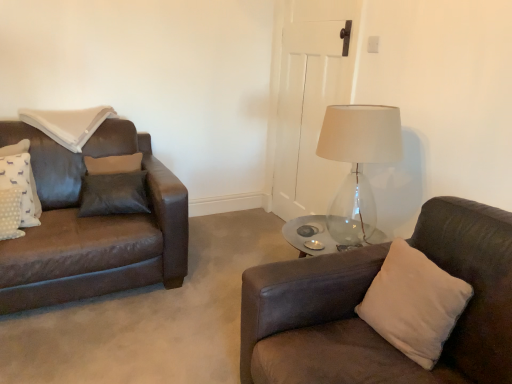
Question: Can you confirm if white fabric pillow at upper left, the 3th pillow viewed from the front, is bigger than white dotted fabric pillow at left, the 3th pillow from the right?

Choices:
 (A) no
 (B) yes

Answer: (B)

Question: Is white fabric pillow at upper left, which is the second pillow in left-to-right order, aimed at white dotted fabric pillow at left, positioned as the second pillow in top-to-bottom order?

Choices:
 (A) yes
 (B) no

Answer: (B)

Question: Is white fabric pillow at upper left, placed as the first pillow when sorted from back to front, surrounding white dotted fabric pillow at left, placed as the second pillow when sorted from front to back?

Choices:
 (A) no
 (B) yes

Answer: (A)

Question: Does white fabric pillow at upper left, marked as the third pillow in a bottom-to-top arrangement, have a greater height compared to white dotted fabric pillow at left, the 3th pillow from the right?

Choices:
 (A) yes
 (B) no

Answer: (B)

Question: Is white fabric pillow at upper left, placed as the first pillow when sorted from back to front, to the left of white dotted fabric pillow at left, which ranks as the 2th pillow in back-to-front order, from the viewer's perspective?

Choices:
 (A) yes
 (B) no

Answer: (B)

Question: Considering the positions of white dotted fabric pillow at left, which appears as the 2th pillow when ordered from the bottom, and white fabric pillow at upper left, which is the second pillow in left-to-right order, in the image, is white dotted fabric pillow at left, which appears as the 2th pillow when ordered from the bottom, taller or shorter than white fabric pillow at upper left, which is the second pillow in left-to-right order,?

Choices:
 (A) short
 (B) tall

Answer: (B)

Question: Visually, is white dotted fabric pillow at left, which ranks as the 2th pillow in back-to-front order, positioned to the left or to the right of white fabric pillow at upper left, placed as the first pillow when sorted from back to front?

Choices:
 (A) left
 (B) right

Answer: (A)

Question: Is point 3,185 closer or farther from the camera than point 62,125?

Choices:
 (A) farther
 (B) closer

Answer: (B)

Question: From a real-world perspective, is white dotted fabric pillow at left, the 3th pillow from the right, physically located above or below white fabric pillow at upper left, which is the second pillow in left-to-right order?

Choices:
 (A) below
 (B) above

Answer: (A)

Question: In terms of width, does white fabric pillow at upper left, placed as the first pillow when sorted from back to front, look wider or thinner when compared to beige suede pillow at right, the third pillow in the top-to-bottom sequence?

Choices:
 (A) thin
 (B) wide

Answer: (B)

Question: Would you say white fabric pillow at upper left, which is the second pillow in left-to-right order, is inside or outside beige suede pillow at right, which is counted as the 3th pillow, starting from the back?

Choices:
 (A) outside
 (B) inside

Answer: (A)

Question: Based on their positions, is white fabric pillow at upper left, the 3th pillow viewed from the front, located to the left or right of beige suede pillow at right, the third pillow in the left-to-right sequence?

Choices:
 (A) right
 (B) left

Answer: (B)

Question: Is white fabric pillow at upper left, which is the 2th pillow from right to left, in front of or behind beige suede pillow at right, which is the first pillow from bottom to top, in the image?

Choices:
 (A) behind
 (B) front

Answer: (A)

Question: Is point (420, 281) positioned closer to the camera than point (102, 117)?

Choices:
 (A) closer
 (B) farther

Answer: (A)

Question: Would you say beige suede pillow at right, the third pillow in the top-to-bottom sequence, is inside or outside white fabric pillow at upper left, placed as the first pillow when sorted from back to front?

Choices:
 (A) inside
 (B) outside

Answer: (B)